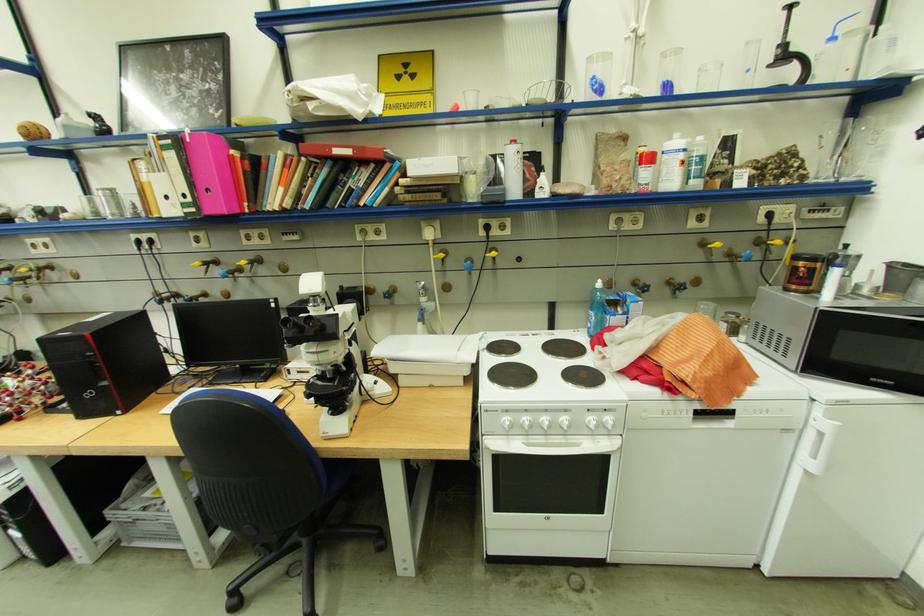
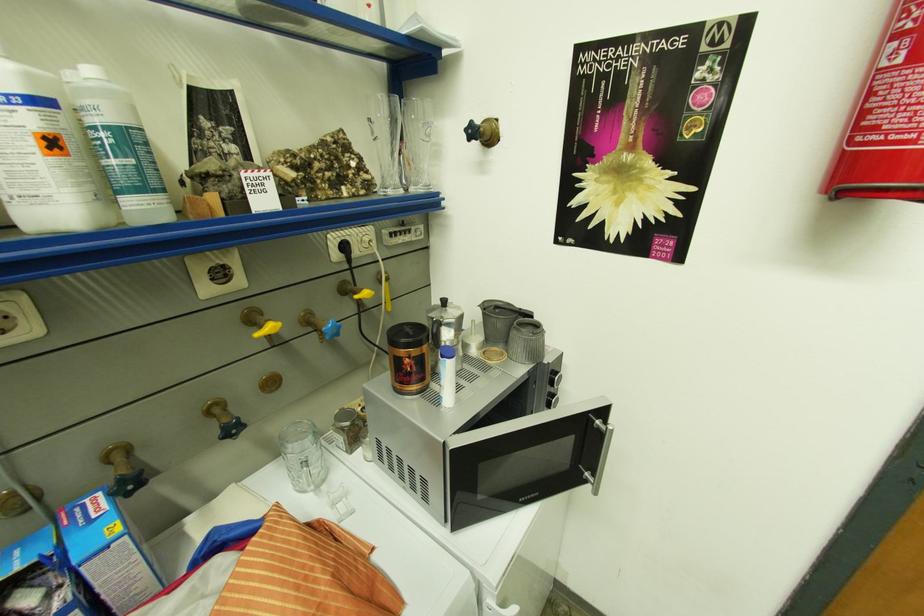
Find the pixel in the second image that matches [691,156] in the first image.

(43, 121)